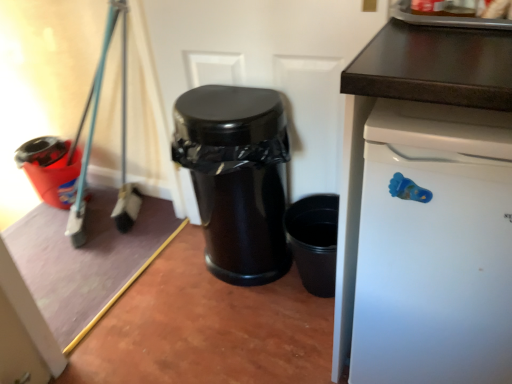
Question: Is matte plastic bucket at left, the first waste container when ordered from back to front, outside of white matte dishwasher at right?

Choices:
 (A) yes
 (B) no

Answer: (A)

Question: Can you confirm if matte plastic bucket at left, the first waste container viewed from the left, is shorter than white matte dishwasher at right?

Choices:
 (A) no
 (B) yes

Answer: (B)

Question: From a real-world perspective, is matte plastic bucket at left, which ranks as the 2th waste container in right-to-left order, beneath white matte dishwasher at right?

Choices:
 (A) yes
 (B) no

Answer: (A)

Question: Is matte plastic bucket at left, the first waste container when ordered from back to front, closer to the viewer compared to white matte dishwasher at right?

Choices:
 (A) yes
 (B) no

Answer: (B)

Question: Does matte plastic bucket at left, the first waste container viewed from the left, lie behind white matte dishwasher at right?

Choices:
 (A) yes
 (B) no

Answer: (A)

Question: Considering the relative sizes of matte plastic bucket at left, which ranks as the 2th waste container in right-to-left order, and white matte dishwasher at right in the image provided, is matte plastic bucket at left, which ranks as the 2th waste container in right-to-left order, wider than white matte dishwasher at right?

Choices:
 (A) yes
 (B) no

Answer: (B)

Question: From a real-world perspective, is glossy black trash can at center, positioned as the first waste container in right-to-left order, positioned over matte plastic bucket at left, the first waste container viewed from the left, based on gravity?

Choices:
 (A) yes
 (B) no

Answer: (A)

Question: Does glossy black trash can at center, positioned as the first waste container in right-to-left order, have a greater width compared to matte plastic bucket at left, the first waste container viewed from the left?

Choices:
 (A) yes
 (B) no

Answer: (B)

Question: Is glossy black trash can at center, the second waste container when ordered from left to right, with matte plastic bucket at left, the first waste container viewed from the left?

Choices:
 (A) no
 (B) yes

Answer: (A)

Question: Would you say glossy black trash can at center, the second waste container when ordered from left to right, is outside matte plastic bucket at left, the first waste container viewed from the left?

Choices:
 (A) yes
 (B) no

Answer: (A)

Question: Is glossy black trash can at center, which is the 1th waste container in front-to-back order, further to the viewer compared to matte plastic bucket at left, the first waste container viewed from the left?

Choices:
 (A) yes
 (B) no

Answer: (B)

Question: Is glossy black trash can at center, which is the second waste container in back-to-front order, closer to the viewer compared to matte plastic bucket at left, the first waste container viewed from the left?

Choices:
 (A) yes
 (B) no

Answer: (A)

Question: Is glossy black trash can at center, positioned as the first waste container in right-to-left order, at the left side of white matte dishwasher at right?

Choices:
 (A) yes
 (B) no

Answer: (A)